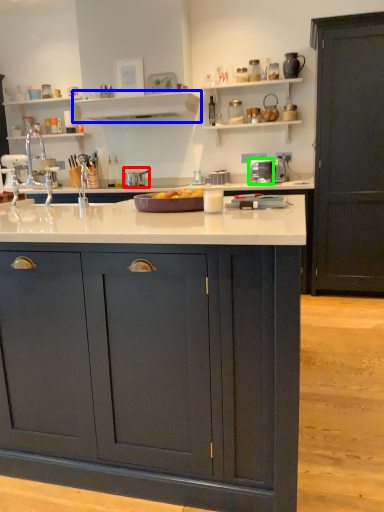
Question: Which object is the closest to the appliance (highlighted by a red box)? Choose among these: shelf (highlighted by a blue box) or appliance (highlighted by a green box).

Choices:
 (A) shelf
 (B) appliance

Answer: (A)